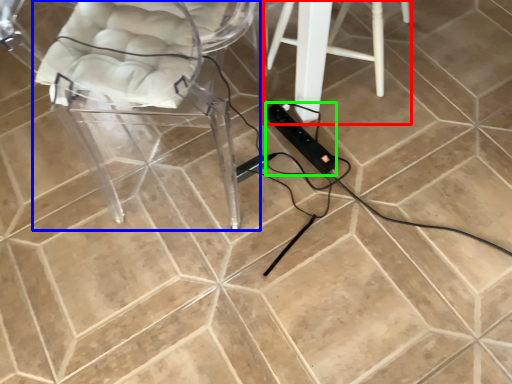
Question: Which is farther away from furniture (highlighted by a red box)? chair (highlighted by a blue box) or extension cord (highlighted by a green box)?

Choices:
 (A) chair
 (B) extension cord

Answer: (A)